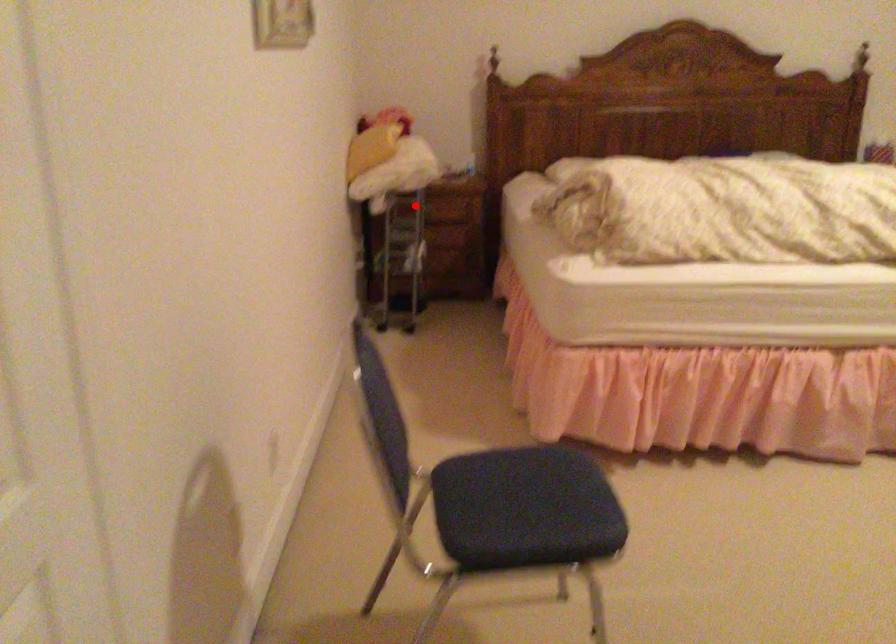
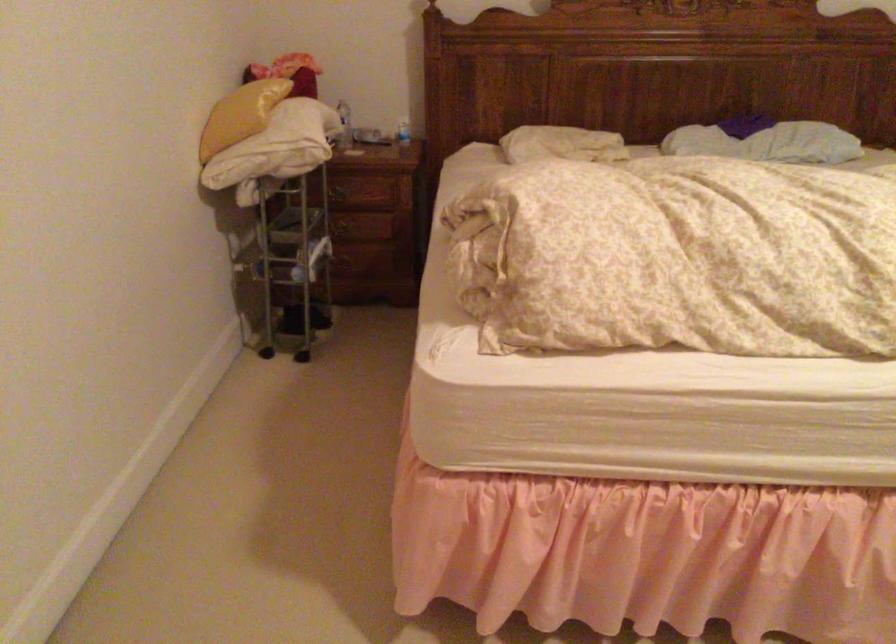
Find the pixel in the second image that matches the highlighted location in the first image.

(338, 194)